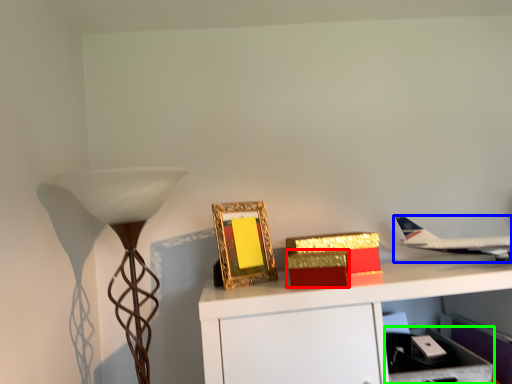
Question: Which is nearer to the cardboard box (highlighted by a red box)? airplane (highlighted by a blue box) or drawer (highlighted by a green box).

Choices:
 (A) airplane
 (B) drawer

Answer: (B)